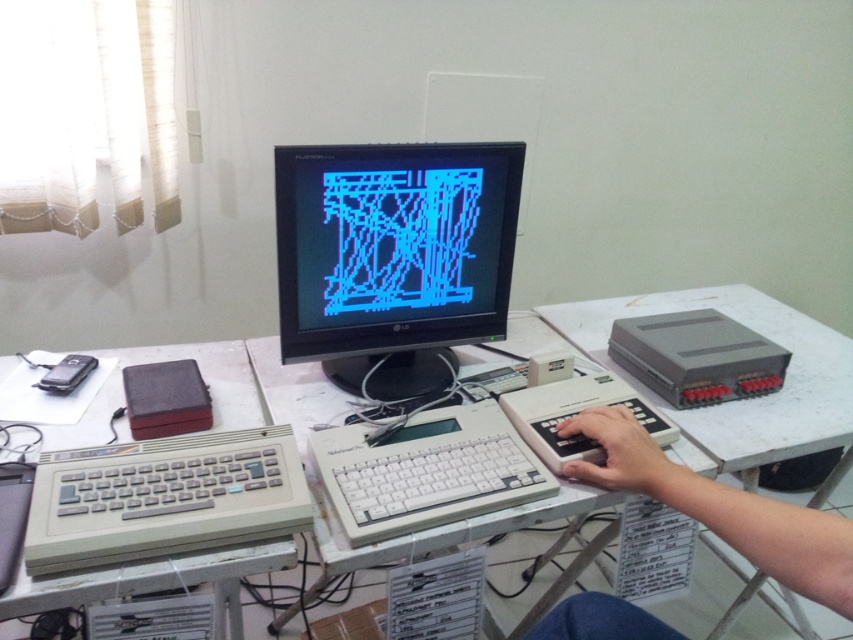
In the scene shown: Who is taller, black glossy monitor at center or white plastic hand at center?

Standing taller between the two is black glossy monitor at center.

Is black glossy monitor at center behind white plastic hand at center?

Yes.

Is point (302, 310) more distant than point (820, 588)?

Yes, it is.

Locate an element on the screen. This screenshot has width=853, height=640. black glossy monitor at center is located at coordinates (393, 257).

The image size is (853, 640). What are the coordinates of `black glossy monitor at center` in the screenshot? It's located at (393, 257).

What do you see at coordinates (393, 257) in the screenshot?
I see `black glossy monitor at center` at bounding box center [393, 257].

The image size is (853, 640). Identify the location of black glossy monitor at center. (393, 257).

Is white plastic table at center taller than black glossy monitor at center?

In fact, white plastic table at center may be shorter than black glossy monitor at center.

Is point (599, 323) positioned in front of point (450, 289)?

That is False.

Does point (764, 618) come farther from viewer compared to point (341, 218)?

Yes.

At what (x,y) coordinates should I click in order to perform the action: click on white plastic table at center. Please return your answer as a coordinate pair (x, y). This screenshot has width=853, height=640. Looking at the image, I should click on pyautogui.click(x=746, y=401).